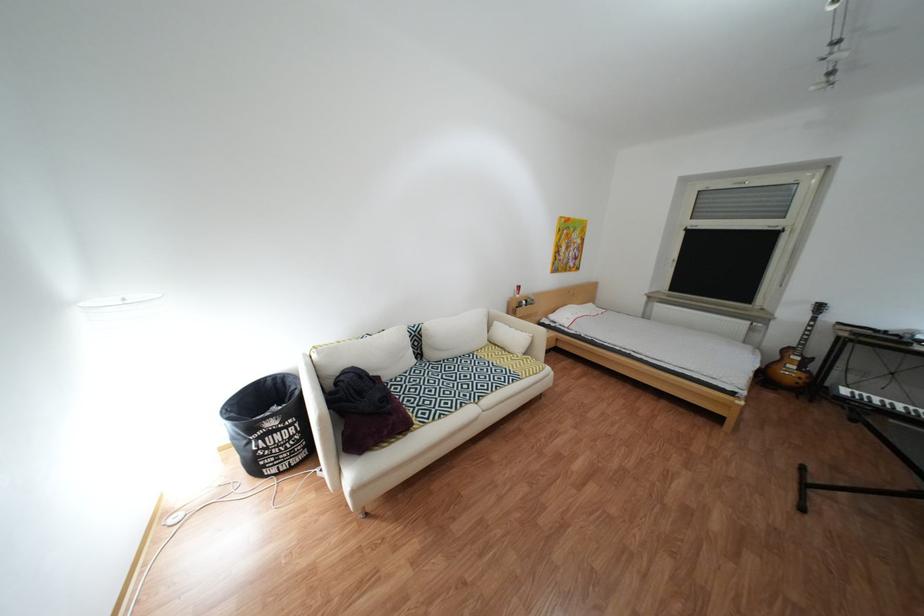
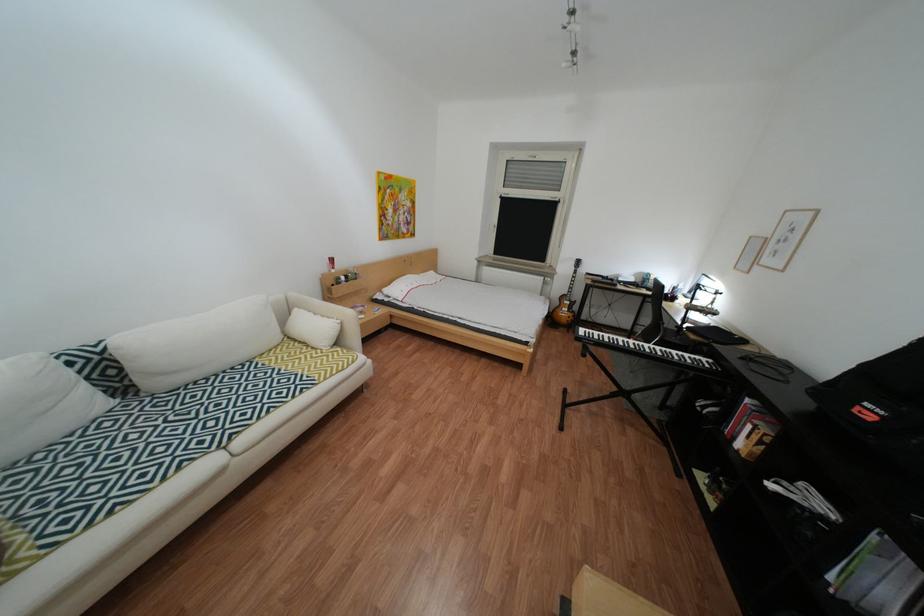
Find the pixel in the second image that matches pixel 430 331 in the first image.

(114, 351)